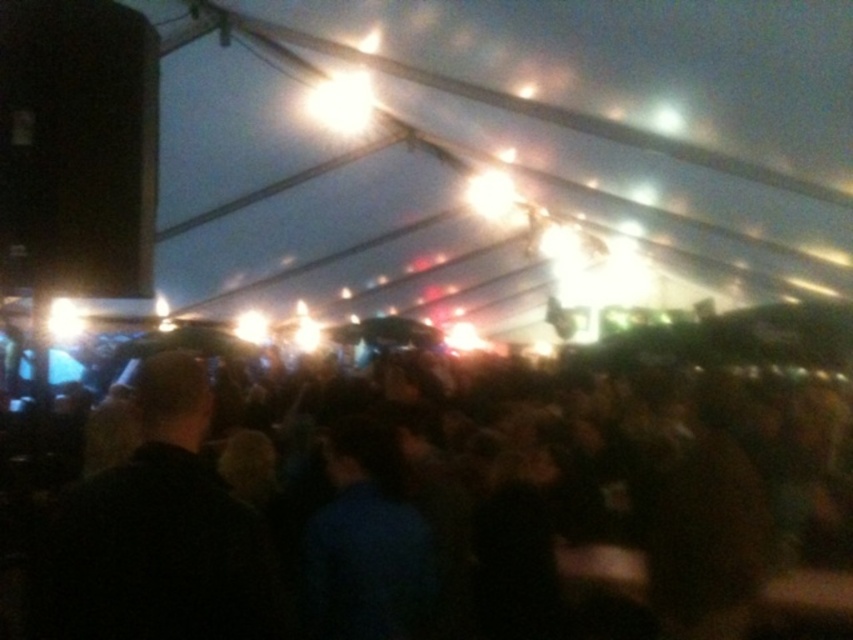
In the scene shown: Can you confirm if black matte crowd at center is positioned to the left of dark hair at center?

No, black matte crowd at center is not to the left of dark hair at center.

Identify the location of black matte crowd at center. pos(462,508).

You are a GUI agent. You are given a task and a screenshot of the screen. Output one action in this format:
    pyautogui.click(x=<x>, y=<y>)
    Task: Click on the black matte crowd at center
    This screenshot has height=640, width=853.
    Given the screenshot: What is the action you would take?
    pyautogui.click(x=462, y=508)

You are a GUI agent. You are given a task and a screenshot of the screen. Output one action in this format:
    pyautogui.click(x=<x>, y=<y>)
    Task: Click on the black matte crowd at center
    The height and width of the screenshot is (640, 853).
    Given the screenshot: What is the action you would take?
    pyautogui.click(x=462, y=508)